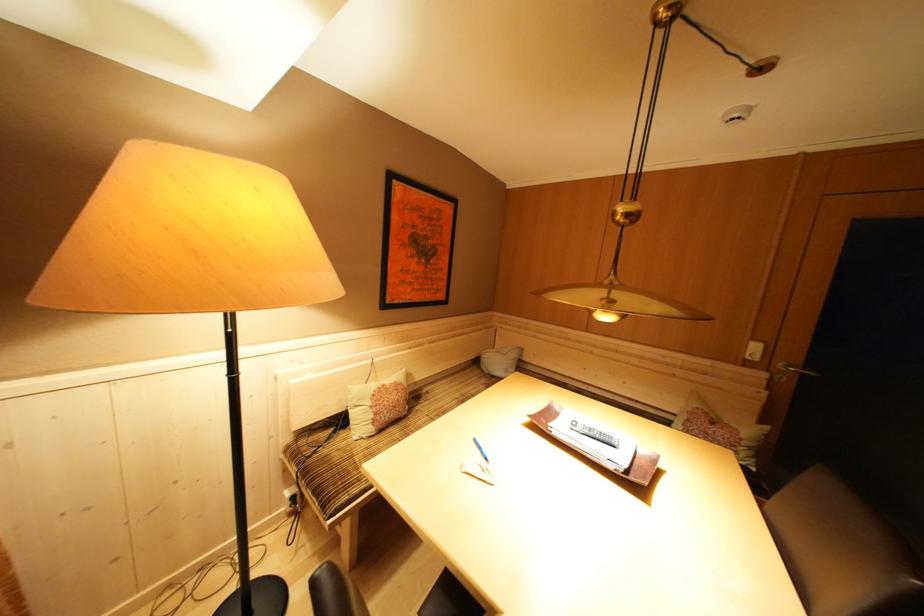
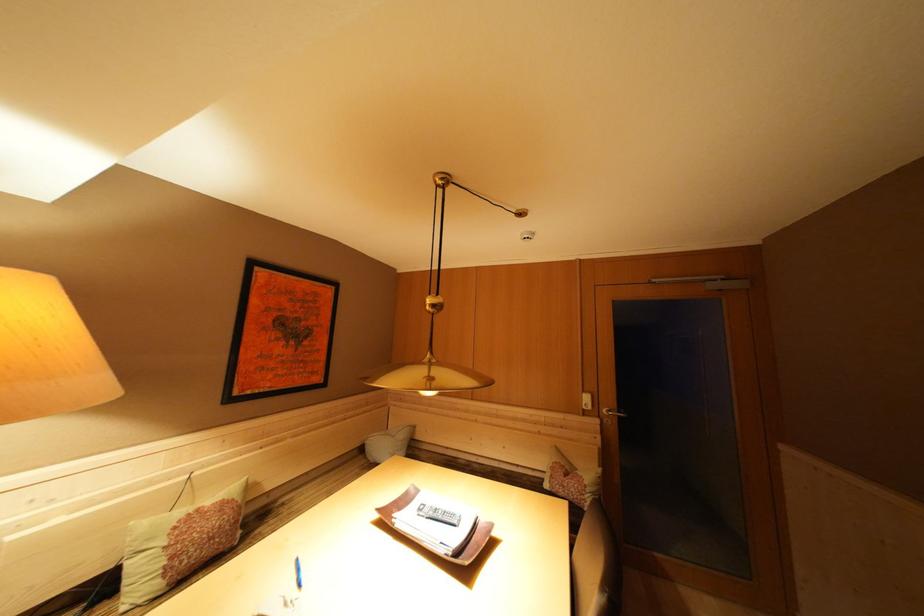
Find the pixel in the second image that matches pixel 759 344 in the first image.

(590, 397)